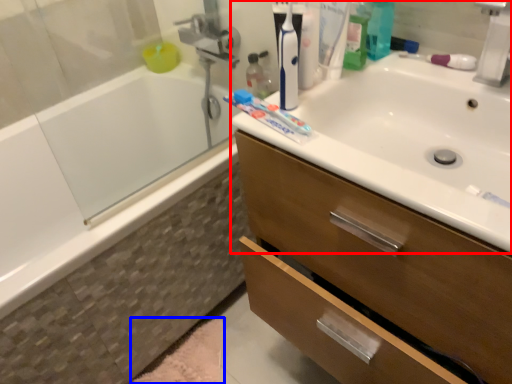
Question: Which of the following is the farthest to the observer, sink (highlighted by a red box) or bath mat (highlighted by a blue box)?

Choices:
 (A) sink
 (B) bath mat

Answer: (B)